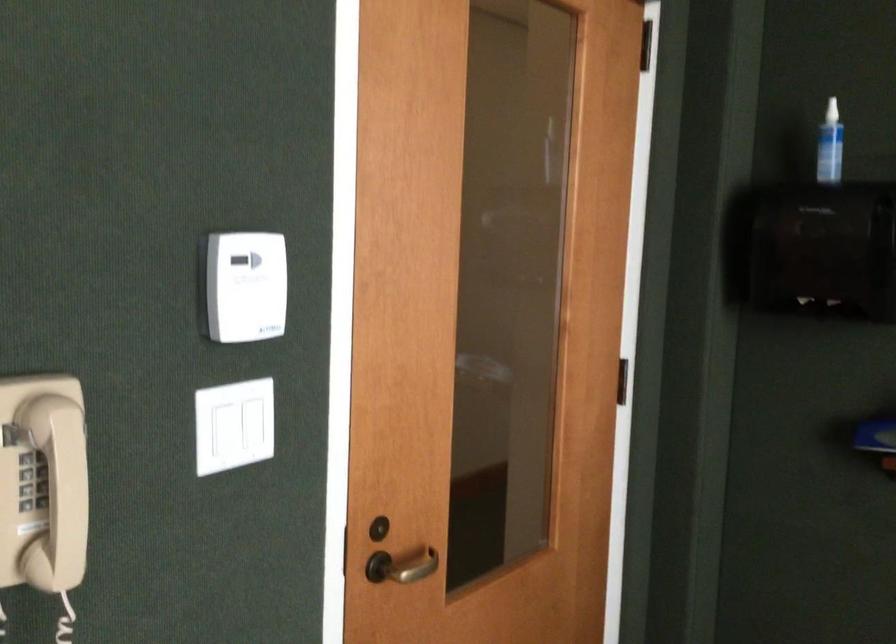
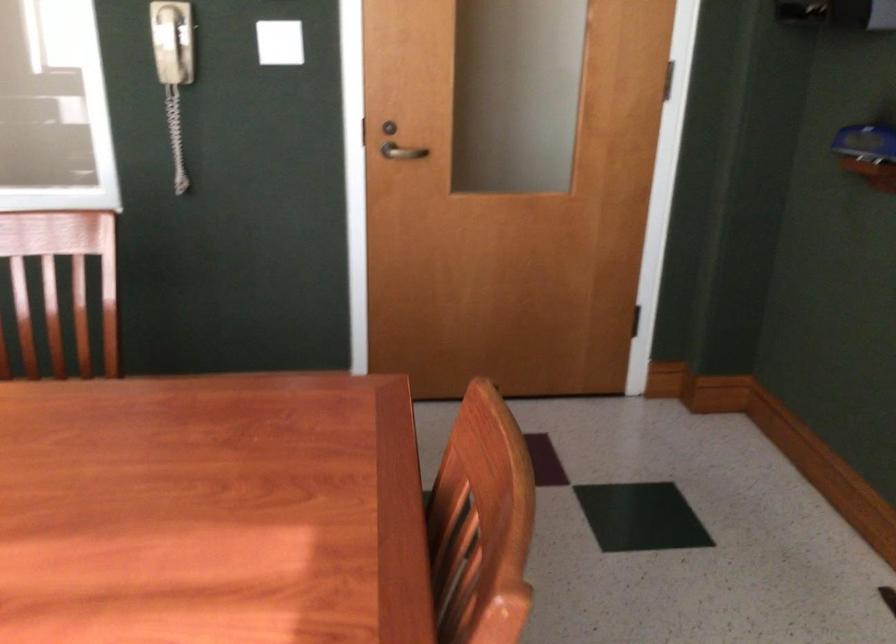
Locate, in the second image, the point that corresponds to the point at 72,474 in the first image.

(171, 41)